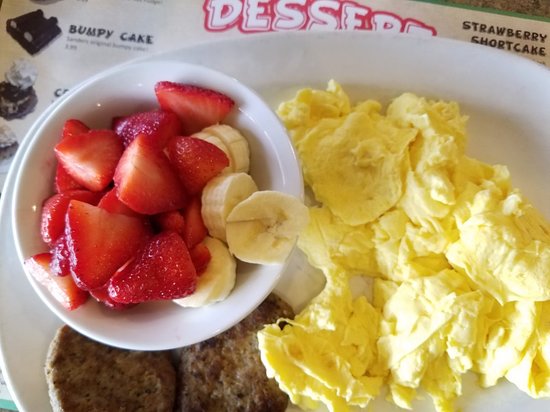
Where is `plate`? This screenshot has height=412, width=550. plate is located at coordinates (27, 326).